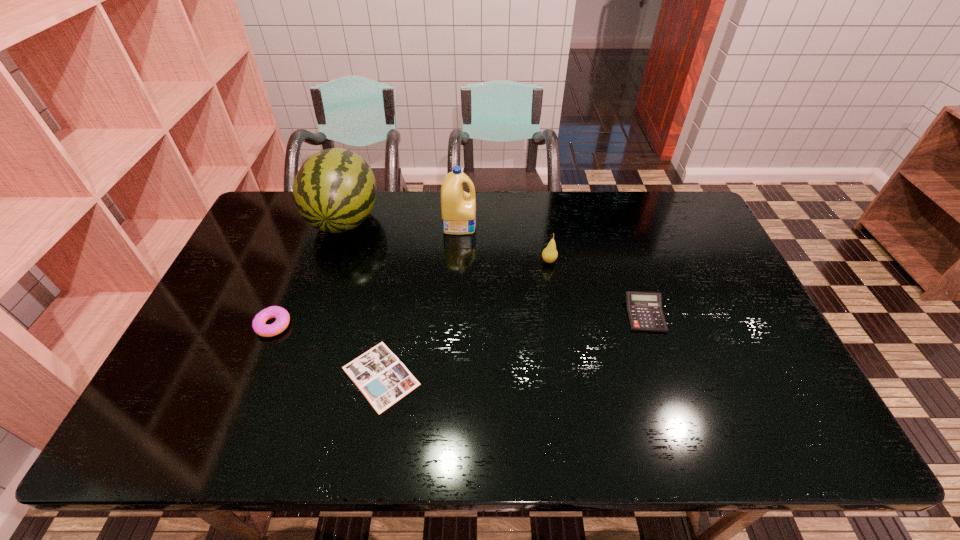
The image size is (960, 540). I want to click on vacant space at the left edge of the desktop, so click(x=235, y=267).

In the image, there is a desktop. At what (x,y) coordinates should I click in order to perform the action: click on vacant space at the right edge. Please return your answer as a coordinate pair (x, y). This screenshot has width=960, height=540. Looking at the image, I should click on click(x=676, y=239).

This screenshot has width=960, height=540. What are the coordinates of `vacant area at the far right corner` in the screenshot? It's located at (667, 200).

The width and height of the screenshot is (960, 540). In the image, there is a desktop. In order to click on vacant space at the near right corner in this screenshot , I will do `click(830, 450)`.

The height and width of the screenshot is (540, 960). I want to click on vacant area that lies between the detergent and the nearest object, so click(x=420, y=300).

The height and width of the screenshot is (540, 960). Identify the location of free spot between the watermelon and the third object from right to left. (402, 222).

Where is `free spot between the pear and the detergent`? free spot between the pear and the detergent is located at coordinates (504, 243).

You are a GUI agent. You are given a task and a screenshot of the screen. Output one action in this format:
    pyautogui.click(x=<x>, y=<y>)
    Task: Click on the vacant area between the doughnut and the third farthest object
    The height and width of the screenshot is (540, 960).
    Given the screenshot: What is the action you would take?
    pyautogui.click(x=411, y=293)

Where is `vacant area that lies between the calculator and the second object from right to left`? Image resolution: width=960 pixels, height=540 pixels. vacant area that lies between the calculator and the second object from right to left is located at coordinates (597, 288).

Where is `free space between the fourth object from left to right and the doughnut`? free space between the fourth object from left to right and the doughnut is located at coordinates (367, 274).